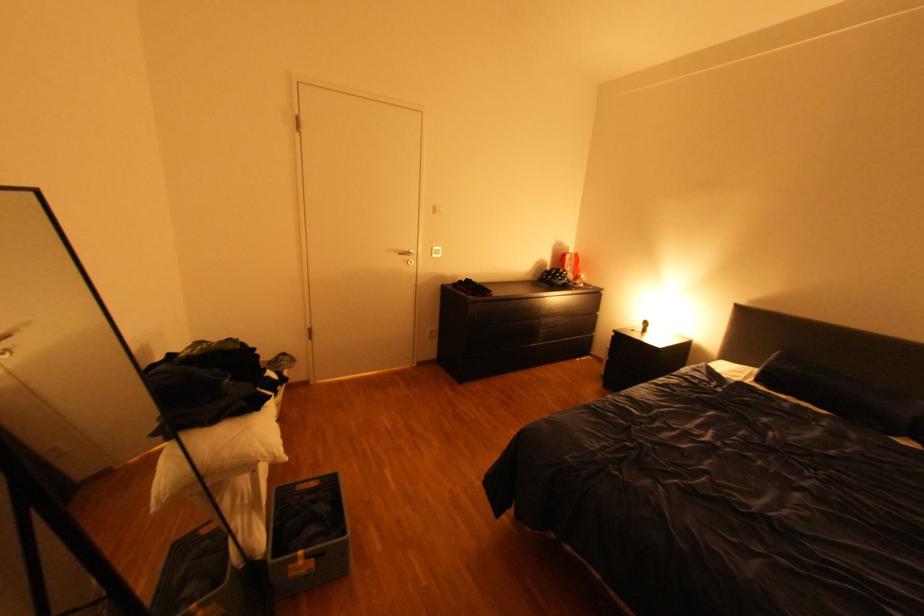
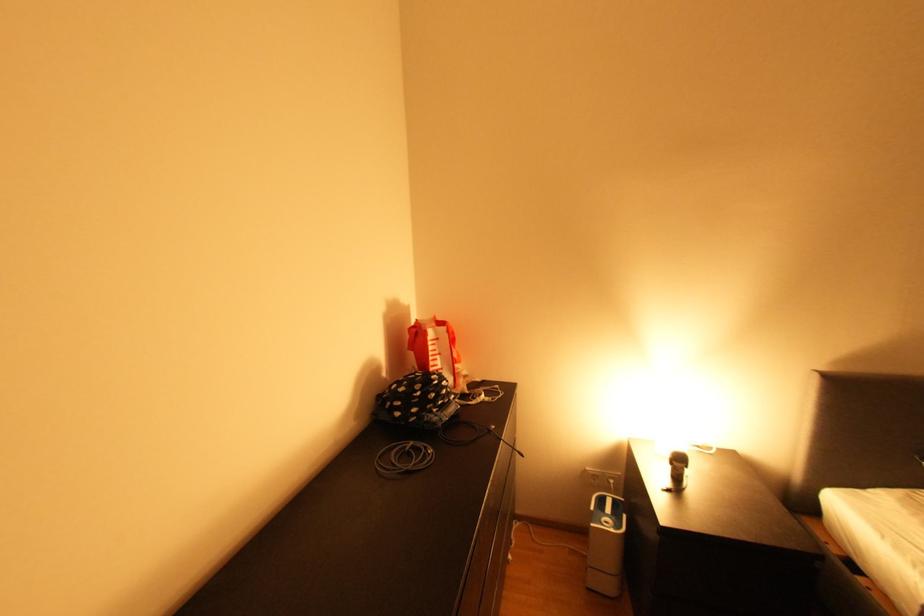
Where in the second image is the point corresponding to point 565,280 from the first image?

(441, 411)